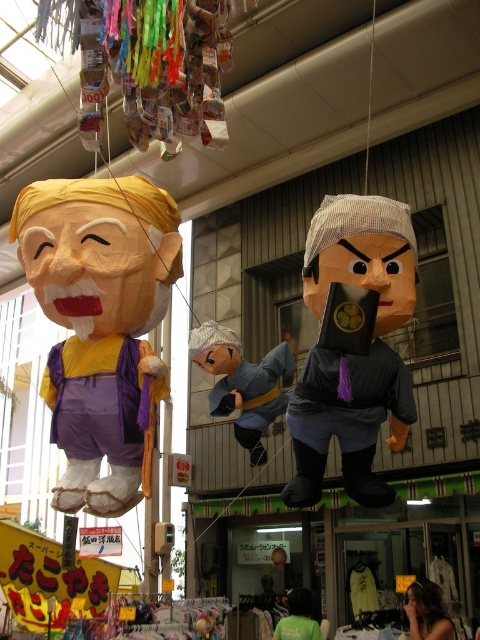
You are a visitor walking down the street and want to touch the smooth brown hair at center. Can you reach it without moving the matte gray fabric toy at center?

The smooth brown hair at center is behind the matte gray fabric toy at center, so you cannot reach it without moving the matte gray fabric toy at center.

You are walking through the shopping arcade and notice two lanterns. One has a matte gray fabric at center and the other has a green fabric shirt at lower center. Which of these two lanterns is positioned further to the right?

The matte gray fabric at center is positioned further to the right compared to the green fabric shirt at lower center.